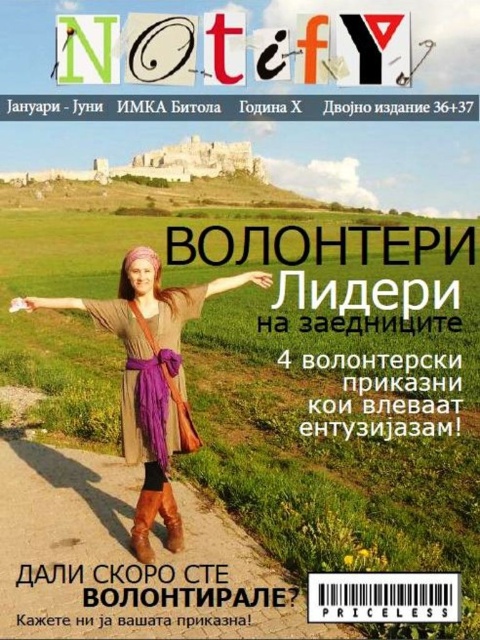
You are a graphic designer working on the layout of the magazine cover. You need to ensure that the purple fabric arm at upper center and the brown leather boot at lower center are positioned such that there is enough space between them for the title text. Given that the title text requires 70 feet of space, is the current spacing sufficient?

The purple fabric arm at upper center and the brown leather boot at lower center are 79.24 feet apart from each other, which is more than the required 70 feet for the title text. Therefore, the current spacing is sufficient.

You are an artist designing a poster for a volunteer event. You have the brown leather boots at lower center and the purple fabric arm at upper center from the magazine cover. If you want to emphasize the size difference between them, which object should you place in a larger scale in your design?

The brown leather boots at lower center is bigger than the purple fabric arm at upper center, so to emphasize the size difference, you should place the brown leather boots at lower center in a larger scale in your design.